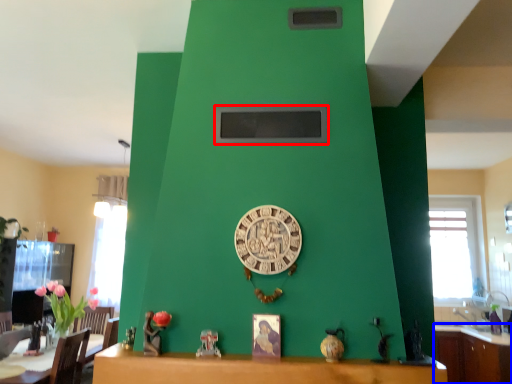
Question: Among these objects, which one is nearest to the camera, window screen (highlighted by a red box) or cabinetry (highlighted by a blue box)?

Choices:
 (A) window screen
 (B) cabinetry

Answer: (A)